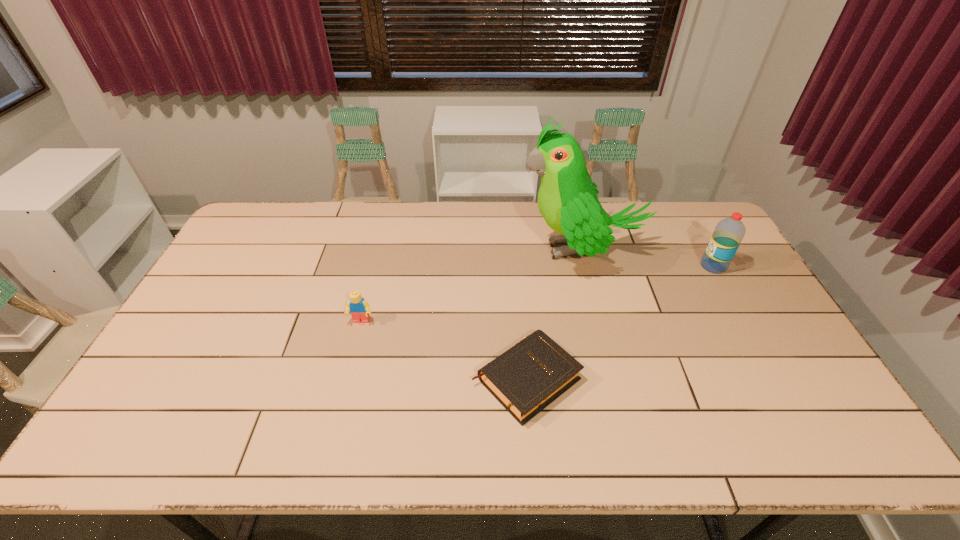
In the image, there is a desktop. Where is `vacant space at the near left corner`? This screenshot has width=960, height=540. vacant space at the near left corner is located at coordinates (161, 446).

You are a GUI agent. You are given a task and a screenshot of the screen. Output one action in this format:
    pyautogui.click(x=<x>, y=<y>)
    Task: Click on the free space at the far right corner
    The image size is (960, 540).
    Given the screenshot: What is the action you would take?
    pyautogui.click(x=711, y=230)

In order to click on empty space between the Lego and the nearest object in this screenshot , I will do `click(444, 350)`.

At what (x,y) coordinates should I click in order to perform the action: click on vacant area that lies between the rightmost object and the leftmost object. Please return your answer as a coordinate pair (x, y). Looking at the image, I should click on (538, 294).

Where is `blank region between the second shortest object and the water bottle`? The width and height of the screenshot is (960, 540). blank region between the second shortest object and the water bottle is located at coordinates (538, 294).

Identify the location of free space between the tallest object and the Bible. The height and width of the screenshot is (540, 960). (554, 314).

The width and height of the screenshot is (960, 540). I want to click on unoccupied position between the parakeet and the Bible, so click(x=554, y=314).

This screenshot has width=960, height=540. I want to click on free spot between the nearest object and the second shortest object, so click(x=444, y=350).

This screenshot has height=540, width=960. Find the location of `free space between the tallest object and the shortest object`. free space between the tallest object and the shortest object is located at coordinates (554, 314).

Locate an element on the screen. free space between the Lego and the second tallest object is located at coordinates (538, 294).